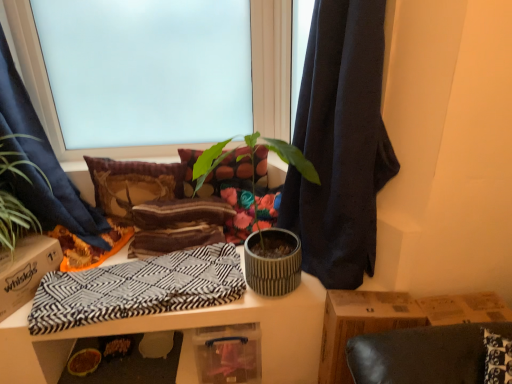
Question: Considering their positions, is green leafy plant at left, positioned as the 2th houseplant in right-to-left order, located in front of or behind textured concrete pot at center, positioned as the second houseplant in left-to-right order?

Choices:
 (A) behind
 (B) front

Answer: (B)

Question: From a real-world perspective, is green leafy plant at left, marked as the first houseplant in a left-to-right arrangement, above or below textured concrete pot at center, positioned as the second houseplant in left-to-right order?

Choices:
 (A) above
 (B) below

Answer: (A)

Question: Which object is the farthest from the brown textured pillow at center, which is the second pillow in right-to-left order?

Choices:
 (A) dark blue fabric at center, the 1th curtain in the right-to-left sequence
 (B) brown cardboard box at left
 (C) frosted glass window at upper center
 (D) textured fabric pillow at center, which appears as the second pillow when viewed from the left
 (E) textured concrete pot at center, which is the 1th houseplant in right-to-left order

Answer: (A)

Question: Which object is the closest to the green leafy plant at left, marked as the first houseplant in a left-to-right arrangement?

Choices:
 (A) blue fabric curtain at left, the 2th curtain positioned from the right
 (B) textured concrete pot at center, positioned as the second houseplant in left-to-right order
 (C) black and white zigzag fabric at center
 (D) dark blue fabric at center, which ranks as the second curtain in left-to-right order
 (E) brown textured pillow at center, the first pillow positioned from the left

Answer: (A)